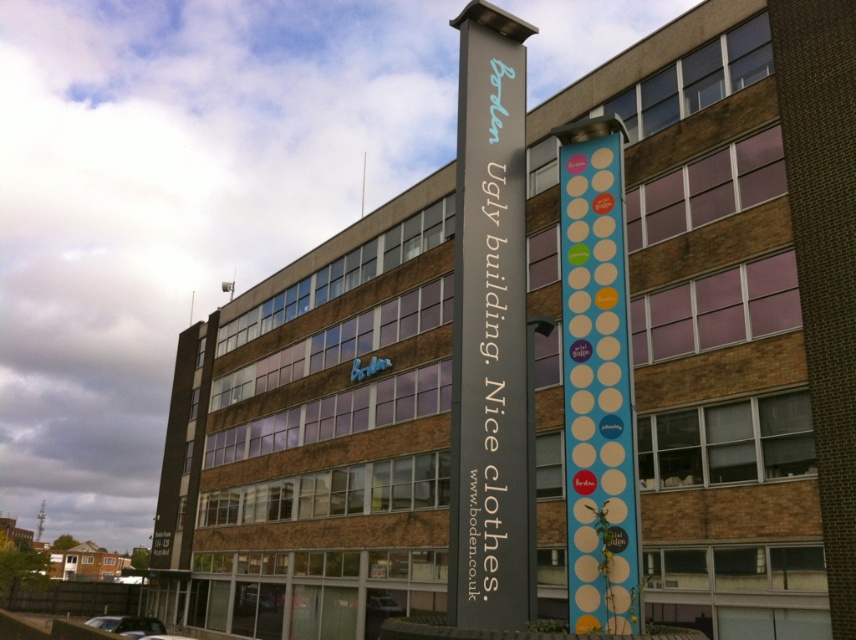
Does dark gray signpost at center have a greater height compared to blue polka dot sign at center?

Correct, dark gray signpost at center is much taller as blue polka dot sign at center.

Measure the distance from dark gray signpost at center to blue polka dot sign at center.

A distance of 1.57 meters exists between dark gray signpost at center and blue polka dot sign at center.

I want to click on dark gray signpost at center, so click(489, 330).